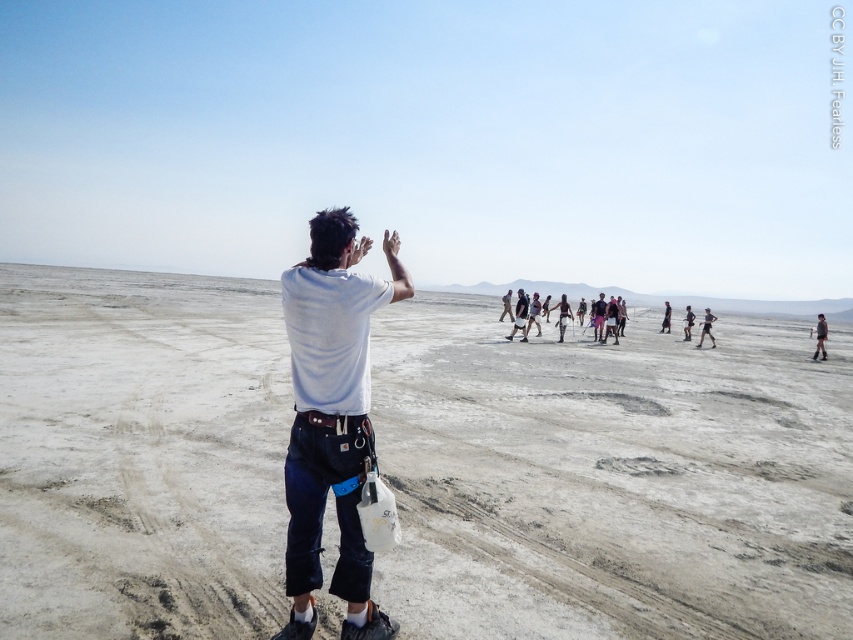
This screenshot has width=853, height=640. Describe the element at coordinates (612, 477) in the screenshot. I see `gray sand at center` at that location.

Does gray sand at center lie in front of dark blue jeans at center?

That is True.

The height and width of the screenshot is (640, 853). I want to click on gray sand at center, so click(x=612, y=477).

Find the location of `gray sand at center`. gray sand at center is located at coordinates (612, 477).

Is point (164, 589) closer to viewer compared to point (666, 310)?

Yes.

Find the location of a particular element. gray sand at center is located at coordinates (x=612, y=477).

Is dark blue jeans at center to the right of light brown fabric pants at center from the viewer's perspective?

No, dark blue jeans at center is not to the right of light brown fabric pants at center.

Describe the element at coordinates (561, 316) in the screenshot. The width and height of the screenshot is (853, 640). I see `dark blue jeans at center` at that location.

Find the location of a particular element. The image size is (853, 640). dark blue jeans at center is located at coordinates (561, 316).